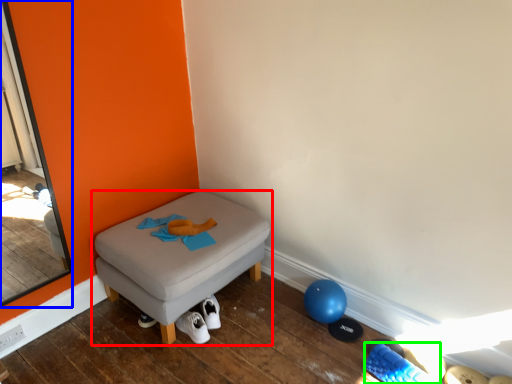
Question: Which is farther away from furniture (highlighted by a red box)? screen door (highlighted by a blue box) or footwear (highlighted by a green box)?

Choices:
 (A) screen door
 (B) footwear

Answer: (B)